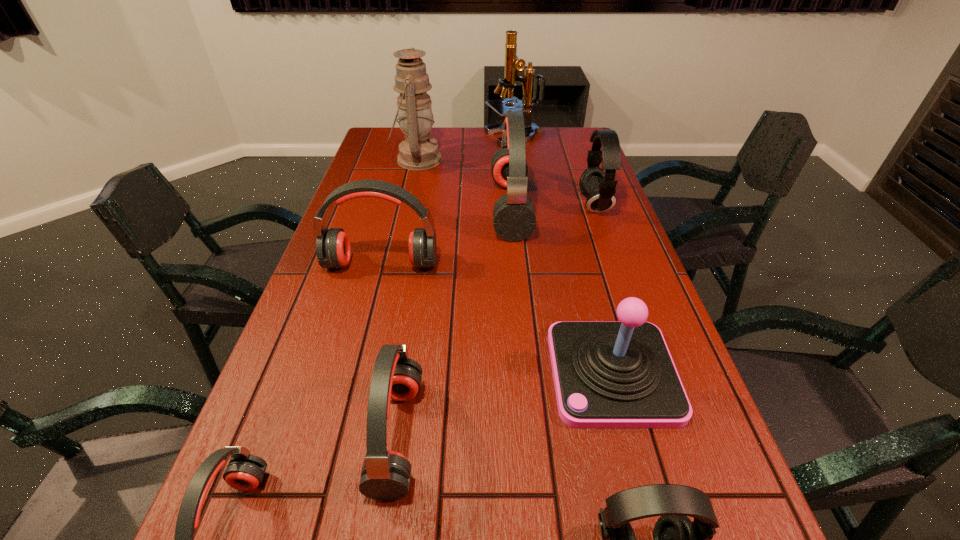
Point out which earphone is positioned as the nearest to the oil lamp. Please provide its 2D coordinates. Your answer should be formatted as a tuple, i.e. [(x, y)], where the tuple contains the x and y coordinates of a point satisfying the conditions above.

[(514, 219)]

Choose which earphone is the fifth nearest neighbor to the oil lamp. Please provide its 2D coordinates. Your answer should be formatted as a tuple, i.e. [(x, y)], where the tuple contains the x and y coordinates of a point satisfying the conditions above.

[(244, 472)]

I want to click on the closest red earphone to the oil lamp, so click(514, 219).

Identify which red earphone is the third nearest to the farther black earphone. Please provide its 2D coordinates. Your answer should be formatted as a tuple, i.e. [(x, y)], where the tuple contains the x and y coordinates of a point satisfying the conditions above.

[(385, 476)]

This screenshot has width=960, height=540. Find the location of `vacant space that satisfies the following two spatial constraints: 1. on the ear cups of the farther black earphone; 2. on the ear cups of the fourth nearest earphone`. vacant space that satisfies the following two spatial constraints: 1. on the ear cups of the farther black earphone; 2. on the ear cups of the fourth nearest earphone is located at coordinates (615, 264).